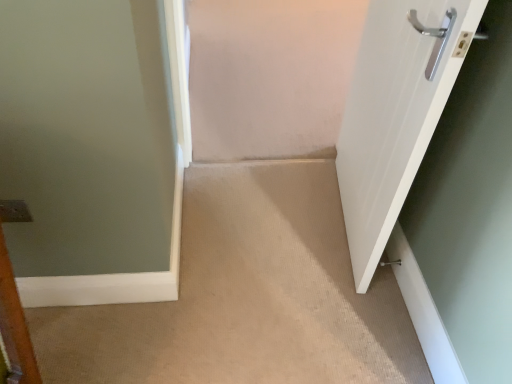
Question: From a real-world perspective, is beige carpet at center beneath white glossy door at right?

Choices:
 (A) yes
 (B) no

Answer: (A)

Question: Does beige carpet at center have a lesser width compared to white glossy door at right?

Choices:
 (A) no
 (B) yes

Answer: (A)

Question: Is beige carpet at center next to white glossy door at right and touching it?

Choices:
 (A) yes
 (B) no

Answer: (B)

Question: Is beige carpet at center further to the viewer compared to white glossy door at right?

Choices:
 (A) no
 (B) yes

Answer: (B)

Question: From a real-world perspective, is beige carpet at center located higher than white glossy door at right?

Choices:
 (A) yes
 (B) no

Answer: (B)

Question: From the image's perspective, is beige carpet at center over white glossy door at right?

Choices:
 (A) no
 (B) yes

Answer: (A)

Question: Is white glossy door at right completely or partially outside of beige carpet at center?

Choices:
 (A) no
 (B) yes

Answer: (B)

Question: Can you see white glossy door at right touching beige carpet at center?

Choices:
 (A) no
 (B) yes

Answer: (A)

Question: Does white glossy door at right have a greater width compared to beige carpet at center?

Choices:
 (A) yes
 (B) no

Answer: (B)

Question: From the image's perspective, does white glossy door at right appear higher than beige carpet at center?

Choices:
 (A) yes
 (B) no

Answer: (A)

Question: Does white glossy door at right come behind beige carpet at center?

Choices:
 (A) no
 (B) yes

Answer: (A)

Question: From a real-world perspective, is white glossy door at right physically below beige carpet at center?

Choices:
 (A) no
 (B) yes

Answer: (A)

Question: Is white glossy door at right smaller than satin silver door handle at lower right?

Choices:
 (A) no
 (B) yes

Answer: (A)